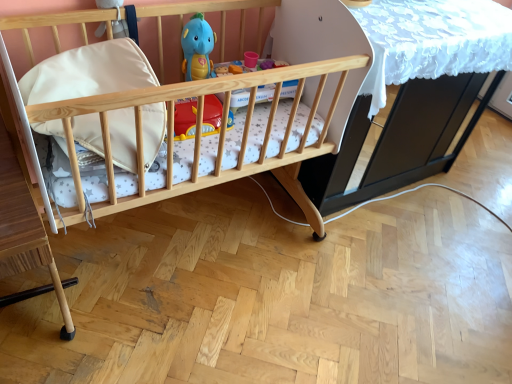
Find the location of a particular element. This screenshot has width=512, height=384. white leather pillow at center is located at coordinates (88, 72).

What do you see at coordinates (198, 48) in the screenshot? The width and height of the screenshot is (512, 384). I see `matte blue plush toy at upper center` at bounding box center [198, 48].

The width and height of the screenshot is (512, 384). What are the coordinates of `white lace table at center` in the screenshot? It's located at (396, 83).

The image size is (512, 384). What are the coordinates of `white leather pillow at center` in the screenshot? It's located at (88, 72).

In the scene shown: How much distance is there between white leather pillow at center and white lace table at center?

The distance of white leather pillow at center from white lace table at center is 36.33 inches.

Is white leather pillow at center not close to white lace table at center?

white leather pillow at center is actually quite close to white lace table at center.

Considering the sizes of objects white leather pillow at center and white lace table at center in the image provided, who is shorter, white leather pillow at center or white lace table at center?

white leather pillow at center is shorter.

Who is smaller, white leather pillow at center or white lace table at center?

white leather pillow at center.

Is white leather pillow at center located outside matte blue plush toy at upper center?

Yes, white leather pillow at center is not within matte blue plush toy at upper center.

Could you tell me if white leather pillow at center is turned towards matte blue plush toy at upper center?

No, white leather pillow at center is not aimed at matte blue plush toy at upper center.

Which object is positioned more to the left, white leather pillow at center or matte blue plush toy at upper center?

Positioned to the left is white leather pillow at center.

Which of these two, white leather pillow at center or matte blue plush toy at upper center, is smaller?

With smaller size is matte blue plush toy at upper center.

Can you see white lace table at center touching matte blue plush toy at upper center?

They are not placed beside each other.

Is white lace table at center inside the boundaries of matte blue plush toy at upper center, or outside?

The correct answer is: outside.

Which point is more distant from viewer, (x=388, y=189) or (x=191, y=56)?

The point (x=388, y=189) is farther from the camera.

Is matte blue plush toy at upper center at the back of white lace table at center?

No.

Is natural wood crib at center taller than white leather pillow at center?

Indeed, natural wood crib at center has a greater height compared to white leather pillow at center.

Is white leather pillow at center located within natural wood crib at center?

Yes.

Identify the location of pillow that is above the natural wood crib at center (from a real-world perspective). (88, 72).

From a real-world perspective, relative to white leather pillow at center, is natural wood crib at center vertically above or below?

Clearly, from a real-world perspective, natural wood crib at center is below white leather pillow at center.

Is point (186, 43) positioned behind point (422, 140)?

No, it is in front of (422, 140).

Could you tell me if matte blue plush toy at upper center is facing white lace table at center?

No, matte blue plush toy at upper center is not oriented towards white lace table at center.

Is matte blue plush toy at upper center not close to white lace table at center?

No, there isn't a large distance between matte blue plush toy at upper center and white lace table at center.

Can white lace table at center be found inside matte blue plush toy at upper center?

No, white lace table at center is not inside matte blue plush toy at upper center.

Considering the sizes of objects white lace table at center and natural wood crib at center in the image provided, who is wider, white lace table at center or natural wood crib at center?

natural wood crib at center is wider.

From the image's perspective, is white lace table at center positioned above or below natural wood crib at center?

white lace table at center is above natural wood crib at center.

Considering the relative sizes of white lace table at center and natural wood crib at center in the image provided, is white lace table at center bigger than natural wood crib at center?

Incorrect, white lace table at center is not larger than natural wood crib at center.

Is white lace table at center far from natural wood crib at center?

A: That's not correct — white lace table at center is a little close to natural wood crib at center.

From the image's perspective, would you say white leather pillow at center is positioned over natural wood crib at center?

Yes, from the image's perspective, white leather pillow at center is over natural wood crib at center.

Considering the positions of objects white leather pillow at center and natural wood crib at center in the image provided, who is more to the left, white leather pillow at center or natural wood crib at center?

Positioned to the left is white leather pillow at center.

Can you tell me how much white leather pillow at center and natural wood crib at center differ in facing direction?

The angular difference between white leather pillow at center and natural wood crib at center is 0.409 degrees.

Locate an element on the screen. infant bed lying on the right of white leather pillow at center is located at coordinates (200, 135).

This screenshot has height=384, width=512. In the image, there is a white leather pillow at center. In order to click on table above it (from the image's perspective) in this screenshot , I will do `click(396, 83)`.

Locate an element on the screen. The width and height of the screenshot is (512, 384). toy directly beneath the white leather pillow at center (from a real-world perspective) is located at coordinates (198, 48).

Looking at the image, which one is located further to white leather pillow at center, white lace table at center or natural wood crib at center?

white lace table at center is further to white leather pillow at center.

Estimate the real-world distances between objects in this image. Which object is further from white leather pillow at center, matte blue plush toy at upper center or natural wood crib at center?

Based on the image, matte blue plush toy at upper center appears to be further to white leather pillow at center.

Considering their positions, is natural wood crib at center positioned closer to matte blue plush toy at upper center than white leather pillow at center?

Among the two, natural wood crib at center is located nearer to matte blue plush toy at upper center.

Considering their positions, is natural wood crib at center positioned further to white lace table at center than white leather pillow at center?

white leather pillow at center is positioned further to the anchor white lace table at center.

Based on their spatial positions, is natural wood crib at center or white lace table at center further from white leather pillow at center?

Among the two, white lace table at center is located further to white leather pillow at center.

Based on their spatial positions, is matte blue plush toy at upper center or white leather pillow at center closer to natural wood crib at center?

white leather pillow at center lies closer to natural wood crib at center than the other object.

When comparing their distances from natural wood crib at center, does white leather pillow at center or matte blue plush toy at upper center seem closer?

Among the two, white leather pillow at center is located nearer to natural wood crib at center.

When comparing their distances from white lace table at center, does matte blue plush toy at upper center or natural wood crib at center seem closer?

The object closer to white lace table at center is natural wood crib at center.

You are a GUI agent. You are given a task and a screenshot of the screen. Output one action in this format:
    pyautogui.click(x=<x>, y=<y>)
    Task: Click on the toy located between natural wood crib at center and white lace table at center in the left-right direction
    Image resolution: width=512 pixels, height=384 pixels.
    Given the screenshot: What is the action you would take?
    pyautogui.click(x=198, y=48)

Find the location of `pillow between natural wood crib at center and matte blue plush toy at upper center from front to back`. pillow between natural wood crib at center and matte blue plush toy at upper center from front to back is located at coordinates point(88,72).

The image size is (512, 384). What are the coordinates of `infant bed between white leather pillow at center and white lace table at center` in the screenshot? It's located at (200, 135).

Locate an element on the screen. Image resolution: width=512 pixels, height=384 pixels. toy located between white leather pillow at center and white lace table at center in the left-right direction is located at coordinates (198, 48).